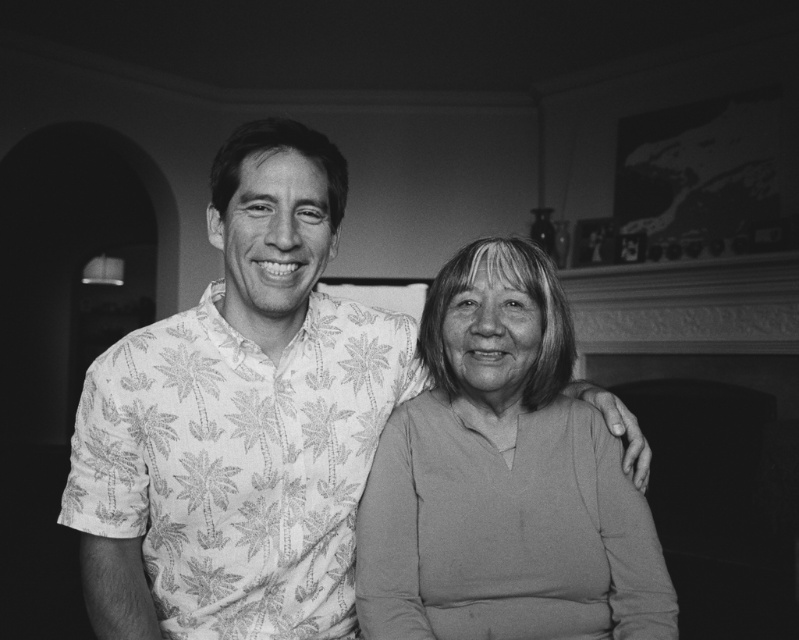
Is point (305, 420) farther from camera compared to point (463, 365)?

No.

Which is above, palm print shirt at left or smooth cotton sweater at center?

palm print shirt at left is higher up.

Is point (253, 454) positioned in front of point (448, 284)?

Yes, it is.

I want to click on palm print shirt at left, so (239, 420).